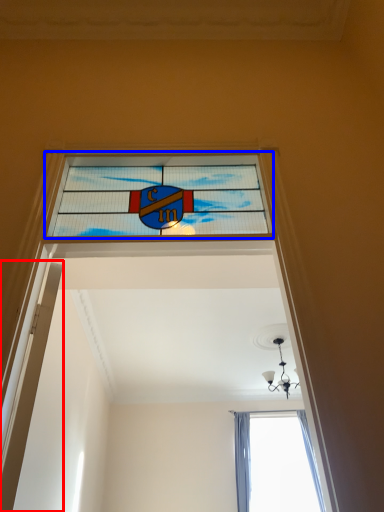
Question: Which point is closer to the camera, door (highlighted by a red box) or window (highlighted by a blue box)?

Choices:
 (A) door
 (B) window

Answer: (A)